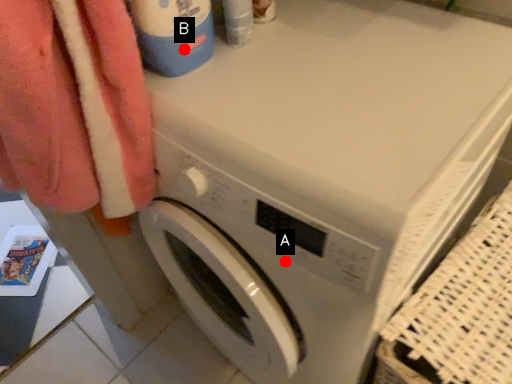
Question: Two points are circled on the image, labeled by A and B beside each circle. Which point appears closest to the camera in this image?

Choices:
 (A) A is closer
 (B) B is closer

Answer: (A)